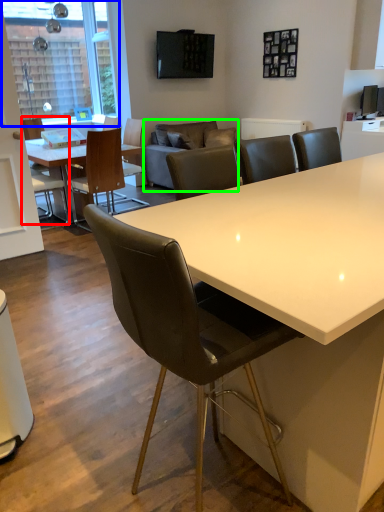
Question: Which object is positioned closest to chair (highlighted by a red box)? Select from window screen (highlighted by a blue box) and couch (highlighted by a green box).

Choices:
 (A) window screen
 (B) couch

Answer: (A)